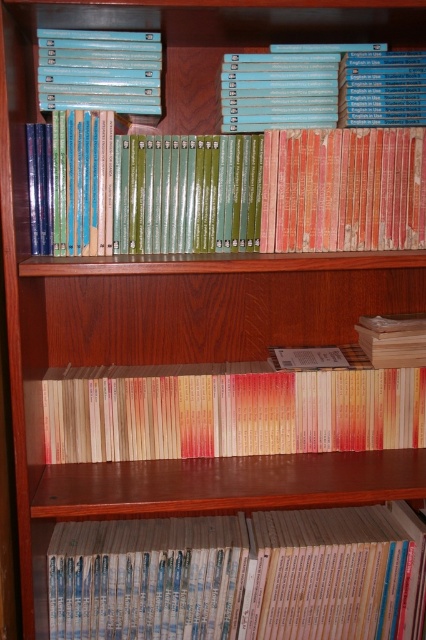
You are organizing books on a wooden bookshelf. You have two books to place on the top shelf. The light beige paperbacks at lower center and the beige paper book at center. Which one should you place first if you want to ensure that the larger book is at the back for stability?

The light beige paperbacks at lower center is larger in size than the beige paper book at center, so you should place the light beige paperbacks at lower center first at the back to ensure stability.

You are organizing books on a wooden bookshelf and need to place a new book between the green matte book at center and the wooden box at center. The new book is 12 inches long. Will there be enough space between them to fit the new book?

The distance between the green matte book at center and the wooden box at center is 14.52 inches. Since the new book is 12 inches long, there is enough space to fit it between them.